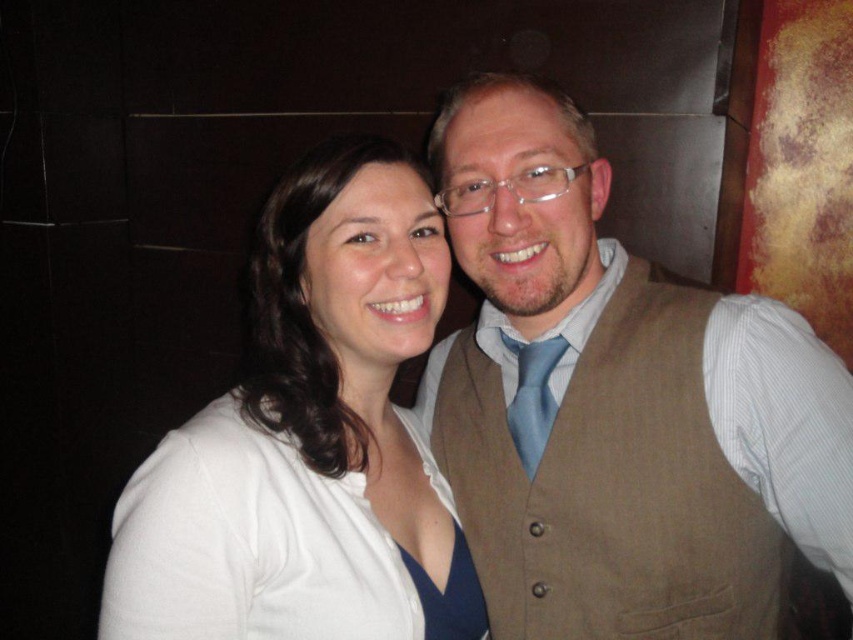
You are a photographer adjusting the lighting for a portrait. You notice the white matte shirt at center and the light blue silk tie at center. Which item should you focus your spotlight on to ensure it stands out more in the photo?

The white matte shirt at center is in front of the light blue silk tie at center, so focusing the spotlight on the white matte shirt at center will make it stand out more as it is closer to the camera.

You are standing in front of the two people in the image. There are two points marked in the image. The first point is at coordinates point (844, 451) and the second point is at point (378, 636). Which point is closer to you?

Point (844, 451) is closer to the viewer than point (378, 636).